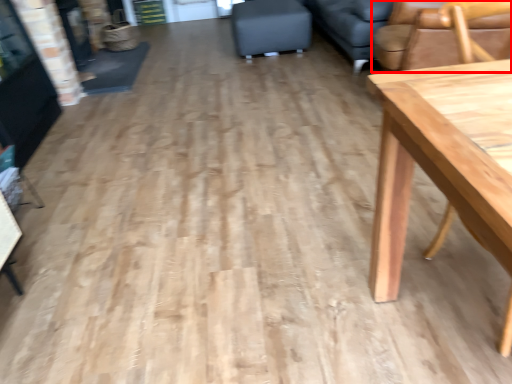
Question: From the image's perspective, what is the correct spatial positioning of chair (annotated by the red box) in reference to swivel chair?

Choices:
 (A) below
 (B) above

Answer: (A)